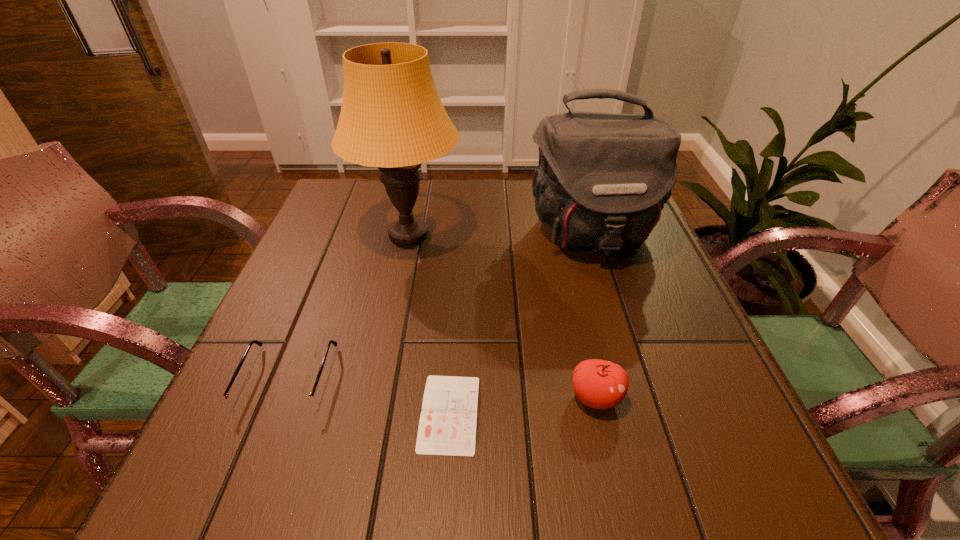
Image resolution: width=960 pixels, height=540 pixels. What are the coordinates of `free space between the second shortest object and the second tallest object` in the screenshot? It's located at pyautogui.click(x=440, y=307).

Identify the location of vacant point located between the spectacles and the tallest object. (348, 307).

I want to click on the fourth closest object to the third shortest object, so click(242, 402).

This screenshot has width=960, height=540. Find the location of `object that ranks as the third closest to the third tallest object`. object that ranks as the third closest to the third tallest object is located at coordinates (391, 117).

What are the coordinates of `vacant space that satisfies the following two spatial constraints: 1. at the hinge ends of the fourth tallest object; 2. on the right side of the apple` in the screenshot? It's located at (281, 397).

The width and height of the screenshot is (960, 540). I want to click on vacant space that satisfies the following two spatial constraints: 1. on the front side of the shortest object; 2. on the right side of the lampshade, so click(x=371, y=413).

I want to click on free spot that satisfies the following two spatial constraints: 1. at the hinge ends of the diary; 2. on the right side of the spectacles, so click(x=275, y=413).

Identify the location of vacant area in the image that satisfies the following two spatial constraints: 1. on the back side of the shortest object; 2. on the right side of the third shortest object. (450, 397).